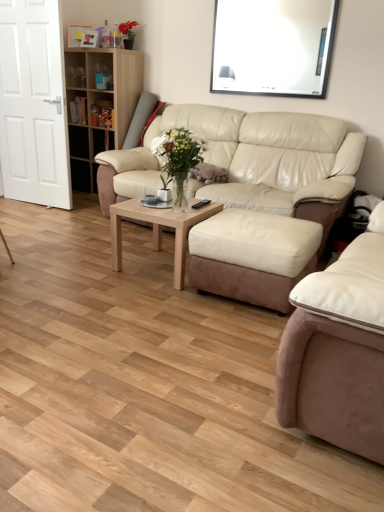
You are a GUI agent. You are given a task and a screenshot of the screen. Output one action in this format:
    pyautogui.click(x=<x>, y=<y>)
    Task: Click on the vacant area situated to the left side of light brown wood coffee table at center
    Image resolution: width=384 pixels, height=512 pixels.
    Given the screenshot: What is the action you would take?
    pyautogui.click(x=97, y=261)